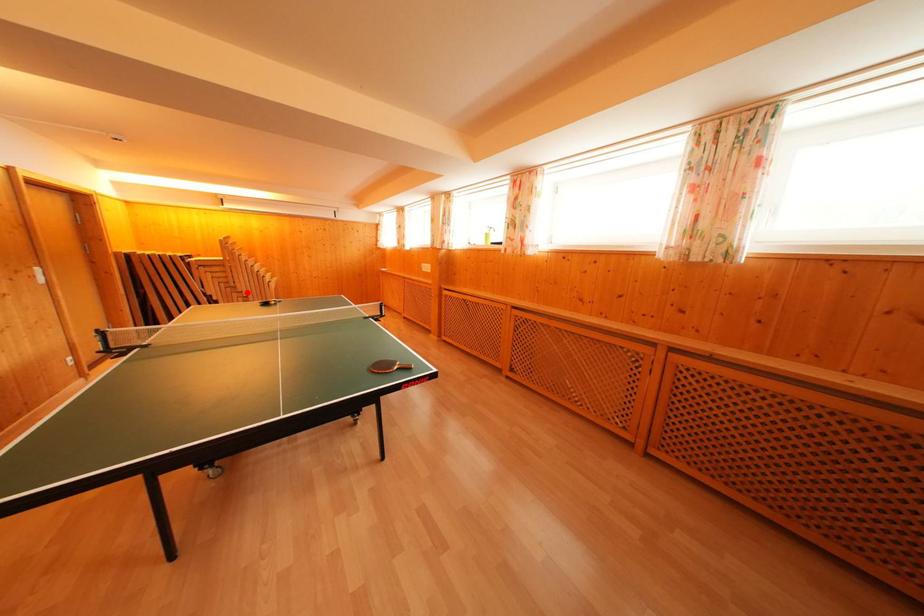
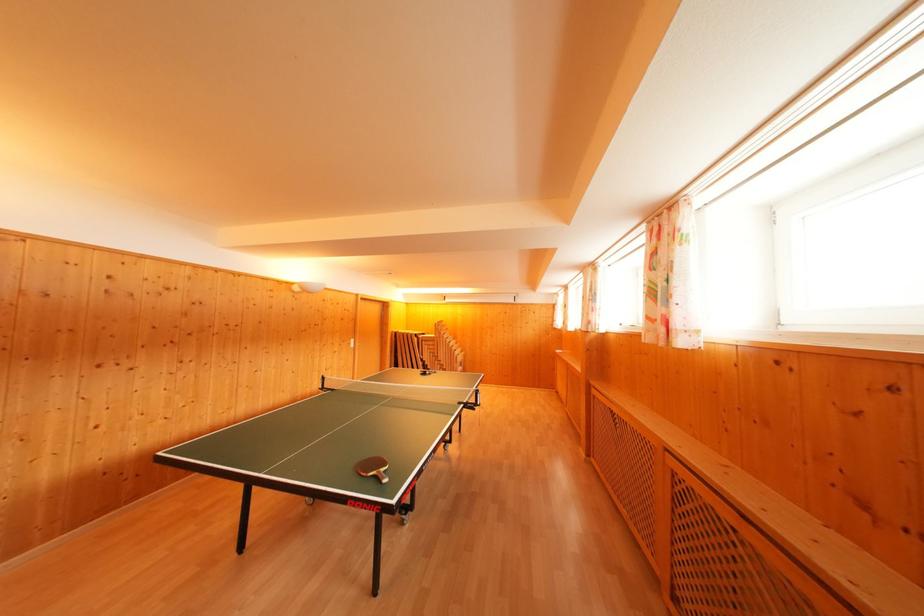
Question: I am providing you with two images of the same scene from different viewpoints. In image1, a red point is highlighted. Considering the same 3D point in image2, which of the following is correct?

Choices:
 (A) It is closer
 (B) It is farther

Answer: (B)